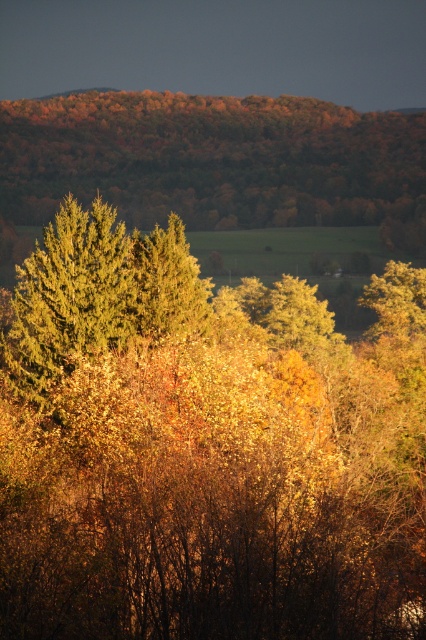
Who is more forward, (161,202) or (134,259)?

Point (134,259) is in front.

Who is more distant from viewer, (227, 134) or (39, 337)?

The point (227, 134) is more distant.

Image resolution: width=426 pixels, height=640 pixels. Find the location of `green matte tree at upper center`. green matte tree at upper center is located at coordinates (215, 161).